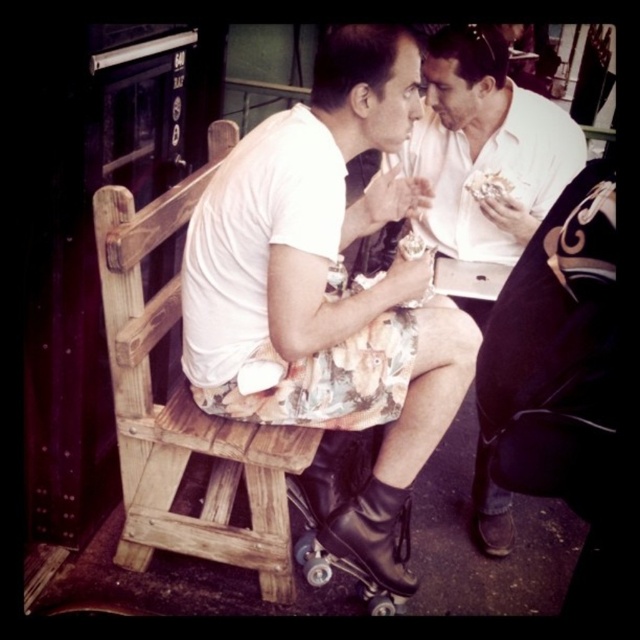
Between point (305, 353) and point (496, 556), which one is positioned behind?

Point (496, 556)

Does floral fabric skirt at center appear under floral-patterned shorts at center?

Indeed, floral fabric skirt at center is positioned under floral-patterned shorts at center.

Does point (307, 273) lie in front of point (586, 157)?

Yes, point (307, 273) is closer to viewer.

Locate an element on the screen. The image size is (640, 640). floral fabric skirt at center is located at coordinates (324, 285).

Does floral fabric skirt at center lie in front of white creamy ice cream at center?

Yes, floral fabric skirt at center is closer to the viewer.

Describe the element at coordinates (324, 285) in the screenshot. I see `floral fabric skirt at center` at that location.

Locate an element on the screen. The image size is (640, 640). floral fabric skirt at center is located at coordinates (x=324, y=285).

Is floral fabric skirt at center smaller than black leather roller skate at lower center?

Incorrect, floral fabric skirt at center is not smaller in size than black leather roller skate at lower center.

Between floral fabric skirt at center and black leather roller skate at lower center, which one appears on the left side from the viewer's perspective?

Positioned to the left is floral fabric skirt at center.

You are a GUI agent. You are given a task and a screenshot of the screen. Output one action in this format:
    pyautogui.click(x=<x>, y=<y>)
    Task: Click on the floral fabric skirt at center
    Image resolution: width=640 pixels, height=640 pixels.
    Given the screenshot: What is the action you would take?
    pyautogui.click(x=324, y=285)

Find the location of a particular element. floral fabric skirt at center is located at coordinates (324, 285).